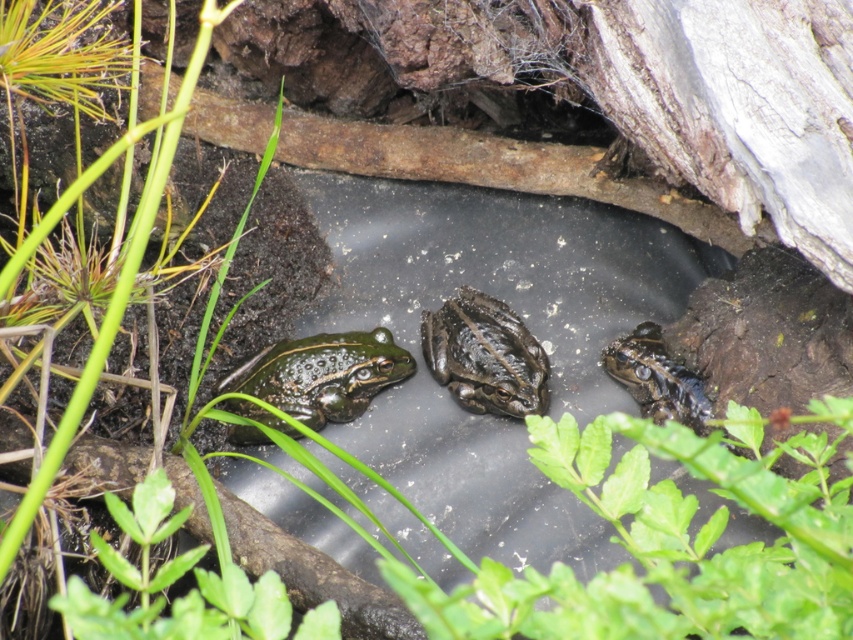
Question: Estimate the real-world distances between objects in this image. Which object is closer to the green textured frog at center?

Choices:
 (A) green shiny skin at center
 (B) shiny green frog at center

Answer: (A)

Question: Can you confirm if green textured frog at center is wider than shiny green frog at center?

Choices:
 (A) no
 (B) yes

Answer: (B)

Question: Estimate the real-world distances between objects in this image. Which object is closer to the shiny green frog at center?

Choices:
 (A) green textured frog at center
 (B) green shiny skin at center

Answer: (A)

Question: Which object is farther from the camera taking this photo?

Choices:
 (A) green textured frog at center
 (B) shiny green frog at center

Answer: (A)

Question: Does green shiny skin at center have a lesser width compared to green textured frog at center?

Choices:
 (A) yes
 (B) no

Answer: (B)

Question: Is green textured frog at center to the left of shiny green frog at center from the viewer's perspective?

Choices:
 (A) yes
 (B) no

Answer: (A)